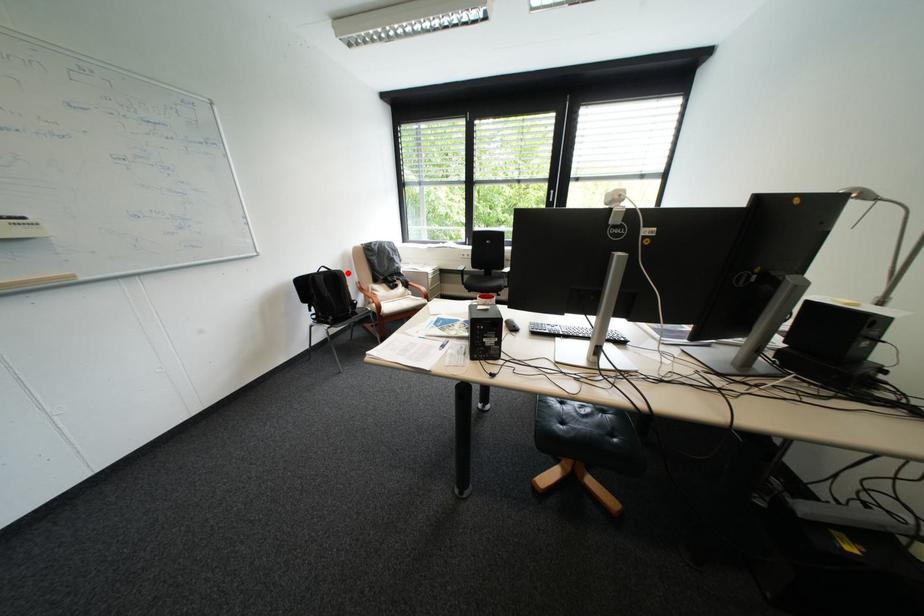
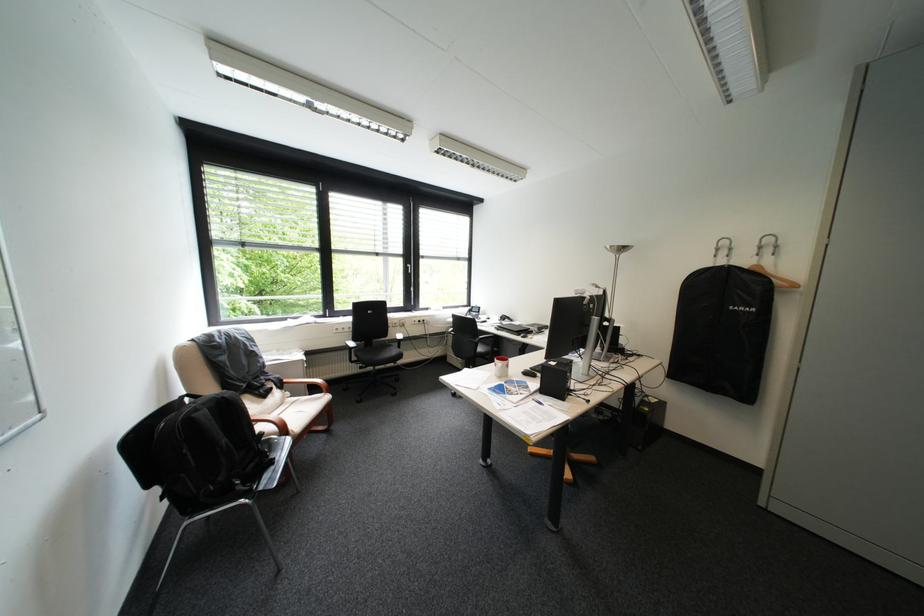
The point at the highlighted location is marked in the first image. Where is the corresponding point in the second image?

(236, 398)